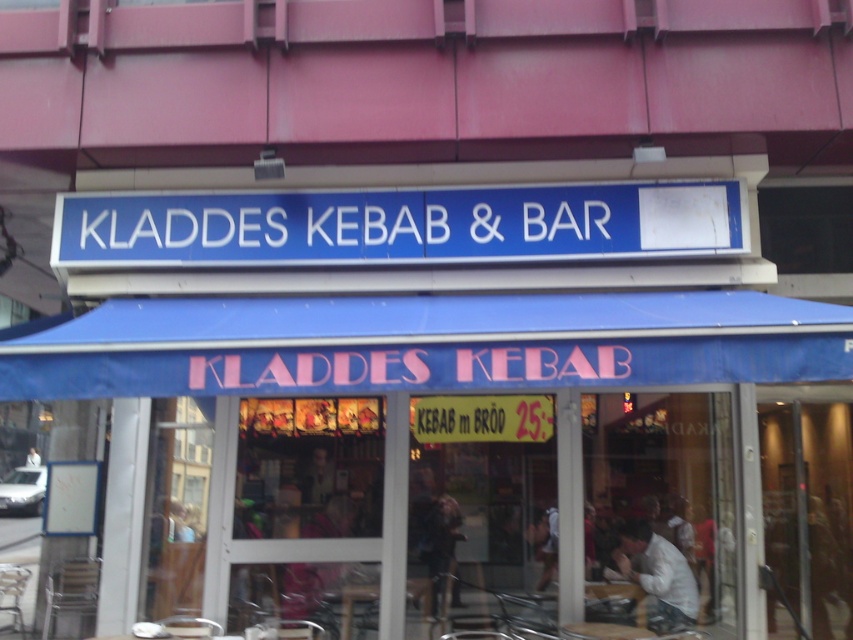
You are a customer standing in front of the Kladdes Kebab restaurant. You see the blue fabric canopy at center and the blue plastic sign at center. Which one is closer to the ground?

The blue fabric canopy at center is located below the blue plastic sign at center, so it is closer to the ground.

You are a delivery person trying to deliver a package to the blue plastic sign at center. You have to place it under the blue fabric canopy at center. Will the package fit under the canopy if the canopy is larger than the sign?

The blue fabric canopy at center is bigger than the blue plastic sign at center. Since the canopy is larger, the package intended for the sign should fit under the canopy without any issues.

You are a delivery person trying to attach a new advertisement to the storefront. The ad is the size of the blue plastic sign at center. Where can you place it so it doesn t overlap with the existing blue fabric canopy at center?

The blue fabric canopy at center is wider than the blue plastic sign at center, so you can place the new advertisement on either side of the blue fabric canopy at center where there is space not covered by the canopy.